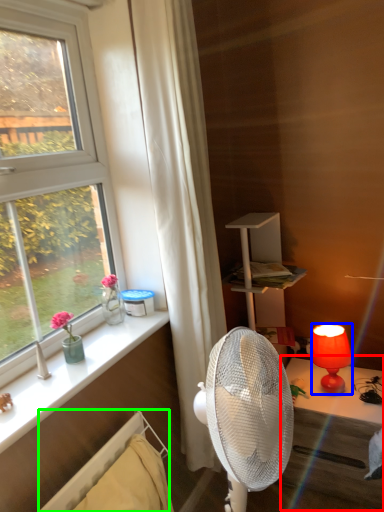
Question: Which object is positioned farthest from table (highlighted by a red box)? Select from lamp (highlighted by a blue box) and radiator (highlighted by a green box).

Choices:
 (A) lamp
 (B) radiator

Answer: (B)